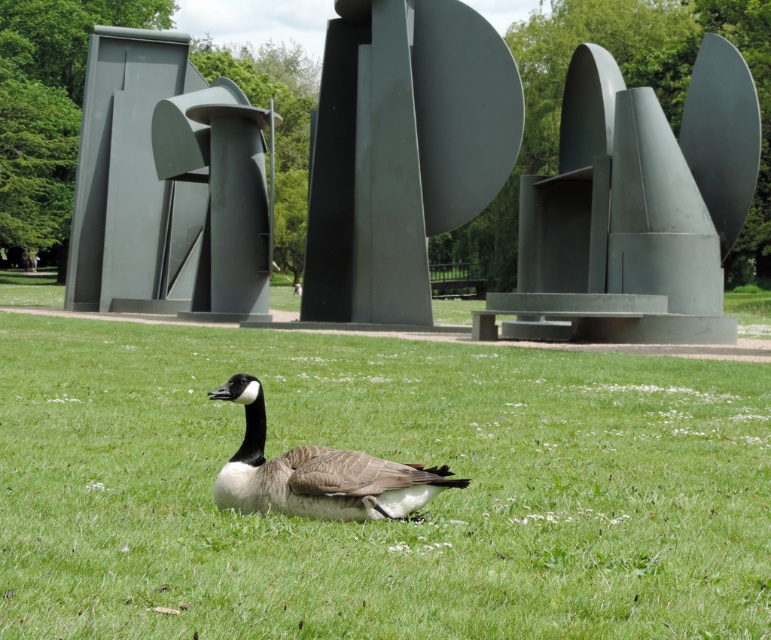
Describe the element at coordinates (635, 205) in the screenshot. The height and width of the screenshot is (640, 771). I see `matte gray sculpture at center` at that location.

Based on the photo, can you confirm if matte gray sculpture at center is thinner than matte gray abstract sculpture at center?

Indeed, matte gray sculpture at center has a lesser width compared to matte gray abstract sculpture at center.

Is point (601, 100) positioned behind point (81, 221)?

That is False.

This screenshot has width=771, height=640. I want to click on matte gray sculpture at center, so click(x=635, y=205).

Between matte gray abstract sculpture at center and brown feathered duck at center, which one is positioned higher?

matte gray abstract sculpture at center is higher up.

Who is lower down, matte gray abstract sculpture at center or brown feathered duck at center?

Positioned lower is brown feathered duck at center.

Which is in front, point (103, 259) or point (308, 509)?

Point (308, 509) is in front.

Identify the location of matte gray abstract sculpture at center. click(x=140, y=179).

Is matte gray sculpture at center wider than brown feathered duck at center?

Correct, the width of matte gray sculpture at center exceeds that of brown feathered duck at center.

Who is more distant from viewer, (x=679, y=157) or (x=288, y=477)?

The point (x=679, y=157) is behind.

Find the location of a particular element. This screenshot has width=771, height=640. matte gray sculpture at center is located at coordinates (635, 205).